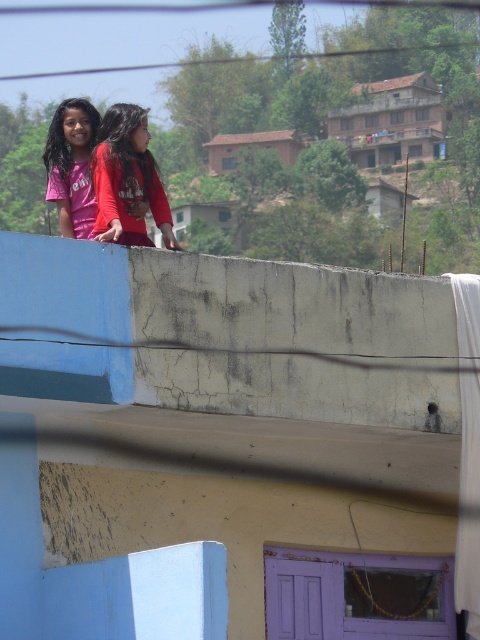
Question: Does matte red shirt at upper left appear under pink matte shirt at upper left?

Choices:
 (A) yes
 (B) no

Answer: (A)

Question: Can you confirm if matte red shirt at upper left is positioned above pink matte shirt at upper left?

Choices:
 (A) no
 (B) yes

Answer: (A)

Question: Does matte red shirt at upper left have a greater width compared to pink matte shirt at upper left?

Choices:
 (A) no
 (B) yes

Answer: (A)

Question: Which point is farther to the camera?

Choices:
 (A) (75, 99)
 (B) (141, 172)

Answer: (A)

Question: Among these objects, which one is nearest to the camera?

Choices:
 (A) pink matte shirt at upper left
 (B) matte red shirt at upper left

Answer: (B)